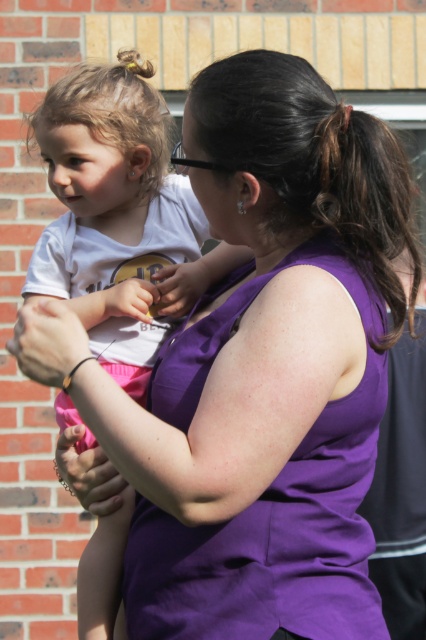
Between white matte shirt at left and dark brown hair at upper center, which one is positioned lower?

white matte shirt at left is lower down.

Between point (100, 221) and point (319, 100), which one is positioned in front?

Point (319, 100) is in front.

Locate an element on the screen. This screenshot has width=426, height=640. white matte shirt at left is located at coordinates (115, 216).